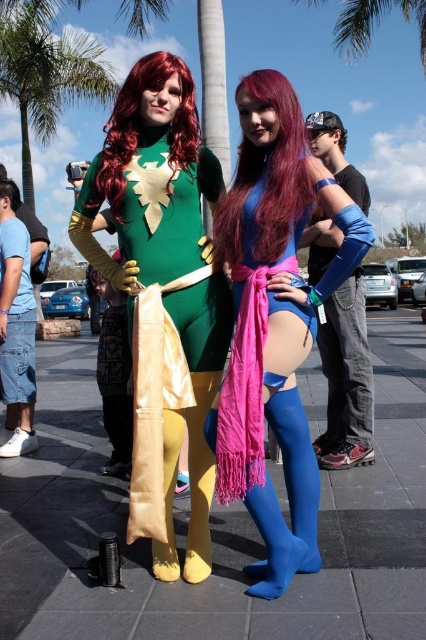
You are a photographer at a superhero convention. You want to take a photo of the blue spandex leggings at center and the green leafy palm tree at upper center. The minimum distance required for your camera to focus both objects clearly is 20 meters. Can you capture both objects in focus without moving the camera?

The blue spandex leggings at center and the green leafy palm tree at upper center are 20.19 meters apart. Since the minimum focus distance required is 20 meters, the camera can focus on both objects as the distance between them is just over the required threshold.

You are a photographer at the superhero convention and need to position the blue spandex leggings at center for a closeup shot. According to the coordinates provided, where exactly should you focus your camera lens?

The blue spandex leggings at center should be focused at point coordinates of 0.503 on the x axis and 0.643 on the y axis as per the given description.

You are a photographer at a superhero convention and need to capture a shot that includes both the blue spandex leggings at center and the green leafy palm tree at upper center. Based on their positions, which object should you focus on first to ensure both are in frame?

The blue spandex leggings at center is positioned on the left side of the green leafy palm tree at upper center. To include both in the frame, focus on the blue spandex leggings at center first as it is closer to the left, then adjust to include the green leafy palm tree at upper center on the right.